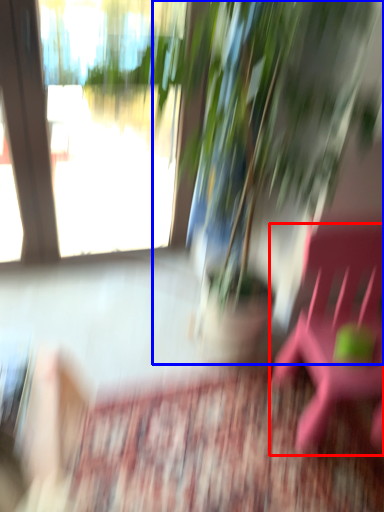
Question: Which of the following is the closest to the observer, beach chair (highlighted by a red box) or houseplant (highlighted by a blue box)?

Choices:
 (A) beach chair
 (B) houseplant

Answer: (A)